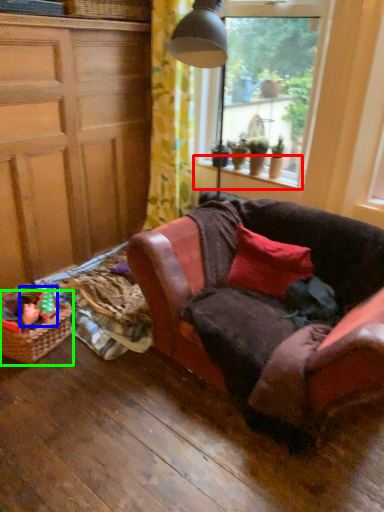
Question: Which is farther away from window sill (highlighted by a red box)? toy (highlighted by a blue box) or picnic basket (highlighted by a green box)?

Choices:
 (A) toy
 (B) picnic basket

Answer: (B)